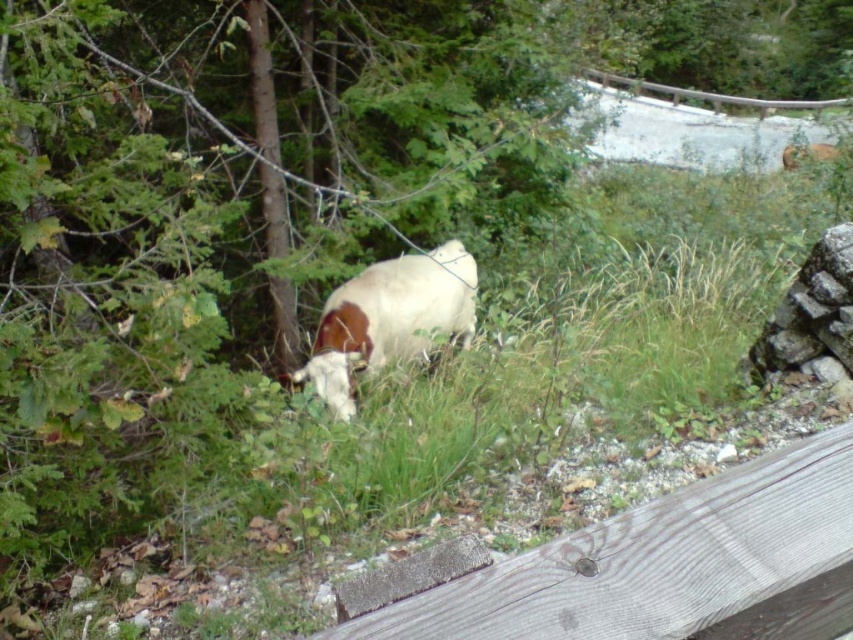
Does gray wood fence at lower right appear on the left side of white woolen goat at upper right?

→ Indeed, gray wood fence at lower right is positioned on the left side of white woolen goat at upper right.

Is gray wood fence at lower right positioned in front of white woolen goat at upper right?

Yes.

Image resolution: width=853 pixels, height=640 pixels. Find the location of `gray wood fence at lower right`. gray wood fence at lower right is located at coordinates (653, 566).

Does white woolen goat at center have a lesser height compared to white woolen goat at upper right?

No.

Does point (315, 360) come closer to viewer compared to point (828, 148)?

Yes.

Who is more distant from viewer, (387, 349) or (791, 150)?

The point (791, 150) is more distant.

Locate an element on the screen. white woolen goat at center is located at coordinates (389, 317).

Is gray wood fence at lower right wider than white woolen goat at center?

In fact, gray wood fence at lower right might be narrower than white woolen goat at center.

Between point (722, 492) and point (460, 333), which one is positioned behind?

Positioned behind is point (460, 333).

At what (x,y) coordinates should I click in order to perform the action: click on gray wood fence at lower right. Please return your answer as a coordinate pair (x, y). Looking at the image, I should click on (653, 566).

Image resolution: width=853 pixels, height=640 pixels. Identify the location of gray wood fence at lower right. click(x=653, y=566).